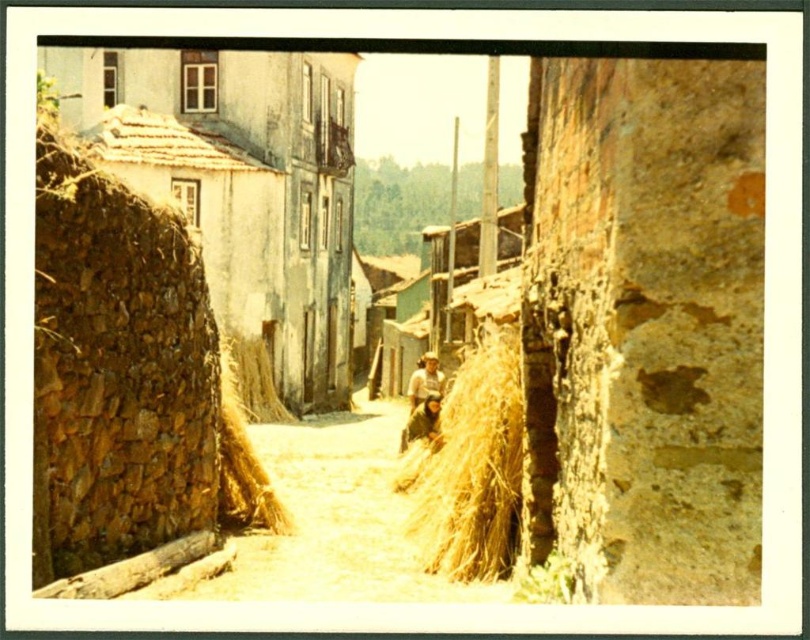
Between golden straw at center and golden straw bale at left, which one appears on the right side from the viewer's perspective?

golden straw at center

Locate an element on the screen. golden straw at center is located at coordinates (339, 518).

Is point (343, 428) farther from camera compared to point (288, 529)?

Yes, point (343, 428) is farther from viewer.

Where is `golden straw at center`? golden straw at center is located at coordinates (339, 518).

Is stone textured hut at left to the left of golden straw bale at left from the viewer's perspective?

Correct, you'll find stone textured hut at left to the left of golden straw bale at left.

Can you confirm if stone textured hut at left is bigger than golden straw bale at left?

Yes, stone textured hut at left is bigger than golden straw bale at left.

Who is more distant from viewer, (335, 337) or (258, 486)?

Point (335, 337)

Where is `stone textured hut at left`? Image resolution: width=810 pixels, height=640 pixels. stone textured hut at left is located at coordinates (241, 184).

Is stone textured hut at left smaller than brown straw at center?

No, stone textured hut at left is not smaller than brown straw at center.

Can you confirm if stone textured hut at left is thinner than brown straw at center?

In fact, stone textured hut at left might be wider than brown straw at center.

Between point (308, 115) and point (246, 369), which one is positioned behind?

Positioned behind is point (308, 115).

The image size is (810, 640). Identify the location of stone textured hut at left. (241, 184).